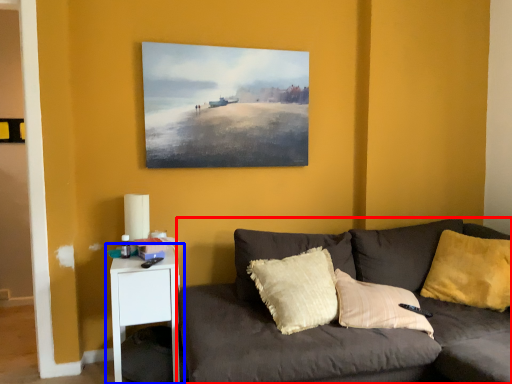
Question: Which point is closer to the camera, studio couch (highlighted by a red box) or nightstand (highlighted by a blue box)?

Choices:
 (A) studio couch
 (B) nightstand

Answer: (A)